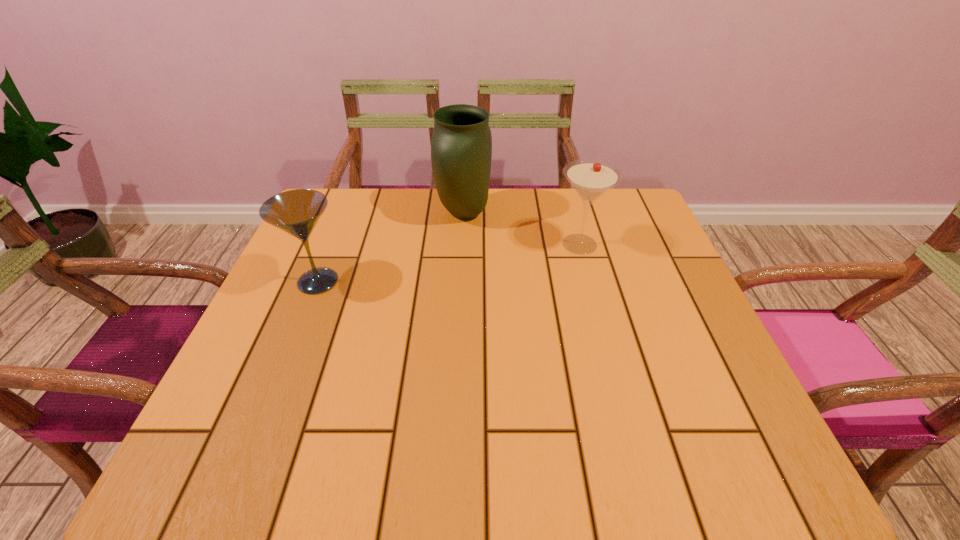
Find the location of a particular element. Image resolution: width=960 pixels, height=540 pixels. object that is the second closest one to the right martini is located at coordinates (296, 212).

Locate which object is the second closest to the left martini. Please provide its 2D coordinates. Your answer should be formatted as a tuple, i.e. [(x, y)], where the tuple contains the x and y coordinates of a point satisfying the conditions above.

[(590, 178)]

The height and width of the screenshot is (540, 960). In order to click on vacant region that satisfies the following two spatial constraints: 1. on the front side of the farther martini; 2. on the left side of the second object from left to right in this screenshot , I will do `click(463, 244)`.

Where is `blank area in the image that satisfies the following two spatial constraints: 1. on the back side of the tallest object; 2. on the left side of the nearest object`? Image resolution: width=960 pixels, height=540 pixels. blank area in the image that satisfies the following two spatial constraints: 1. on the back side of the tallest object; 2. on the left side of the nearest object is located at coordinates (346, 213).

Locate an element on the screen. The height and width of the screenshot is (540, 960). vacant region that satisfies the following two spatial constraints: 1. on the back side of the nearer martini; 2. on the left side of the vase is located at coordinates (346, 213).

Find the location of a particular element. The height and width of the screenshot is (540, 960). vacant point that satisfies the following two spatial constraints: 1. on the back side of the tallest object; 2. on the right side of the left martini is located at coordinates (346, 213).

I want to click on vacant space that satisfies the following two spatial constraints: 1. on the back side of the nearer martini; 2. on the right side of the second object from right to left, so click(346, 213).